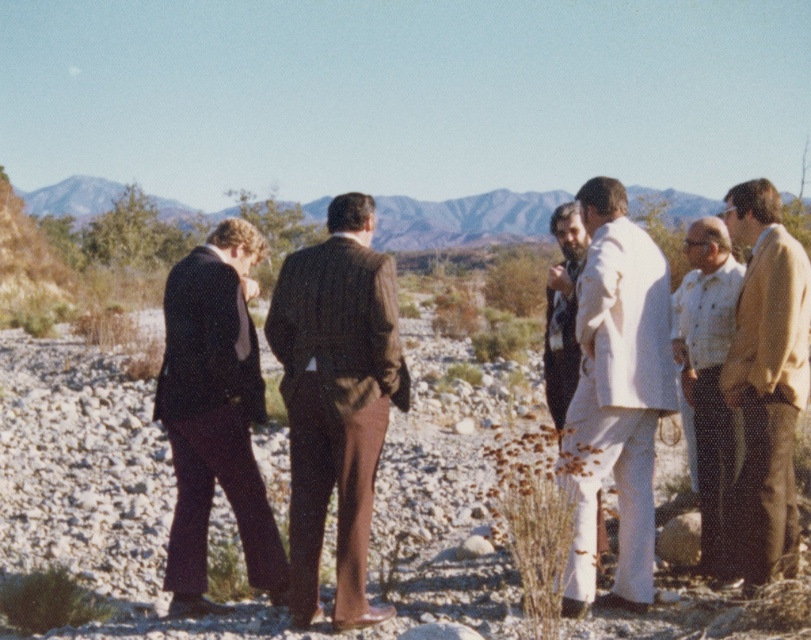
Is point (209, 486) positioned after point (573, 316)?

That is False.

Based on the photo, does dark brown suit at left have a smaller size compared to white cotton shirt at right?

Yes, dark brown suit at left is smaller than white cotton shirt at right.

Where is `dark brown suit at left`? dark brown suit at left is located at coordinates (215, 413).

Between brown wool suit at center and white cotton shirt at right, which one has more height?

Standing taller between the two is white cotton shirt at right.

Does point (271, 316) come in front of point (546, 394)?

Yes, it is in front of point (546, 394).

What are the coordinates of `brown wool suit at center` in the screenshot? It's located at (337, 400).

Can you confirm if brown wool suit at center is thinner than dark brown suit at left?

Yes.

Can you confirm if brown wool suit at center is bigger than dark brown suit at left?

Incorrect, brown wool suit at center is not larger than dark brown suit at left.

I want to click on brown wool suit at center, so click(337, 400).

At what (x,y) coordinates should I click in order to perform the action: click on brown wool suit at center. Please return your answer as a coordinate pair (x, y). This screenshot has width=811, height=640. Looking at the image, I should click on (337, 400).